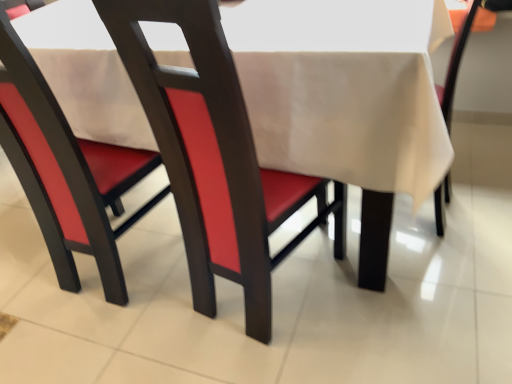
Locate an element on the screen. The width and height of the screenshot is (512, 384). vacant space in between beige fabric chair at center, marked as the 1th chair in a right-to-left arrangement, and beige fabric tablecloth at center is located at coordinates (434, 271).